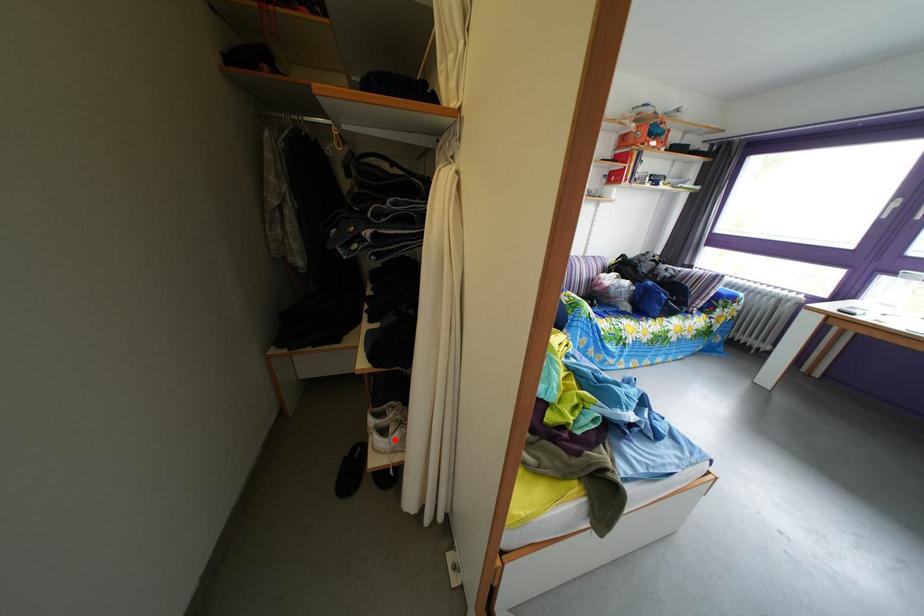
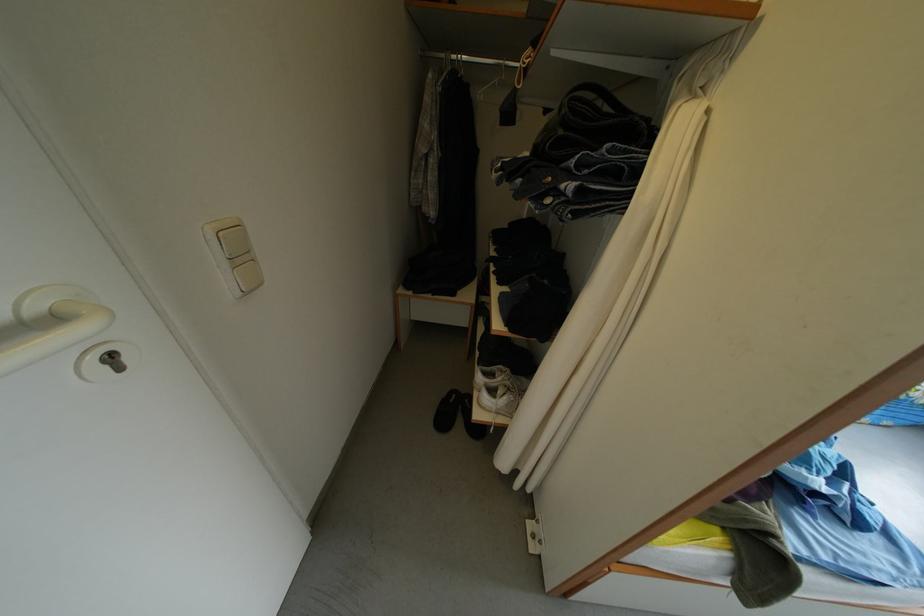
Question: I am providing you with two images of the same scene from different viewpoints. A red point is shown in image1. For the corresponding object point in image2, is it positioned nearer or farther from the camera?

Choices:
 (A) Nearer
 (B) Farther

Answer: (A)